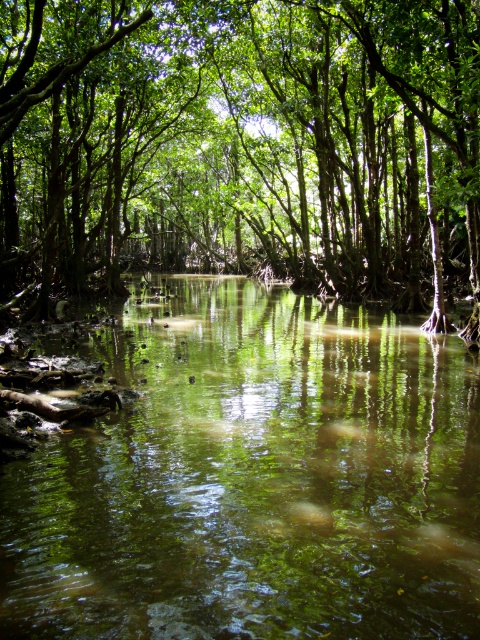
Who is shorter, green reflective water at center or green leafy tree at center?

green reflective water at center

Is green reflective water at center smaller than green leafy tree at center?

Correct, green reflective water at center occupies less space than green leafy tree at center.

This screenshot has width=480, height=640. In order to click on green reflective water at center in this screenshot , I will do `click(253, 477)`.